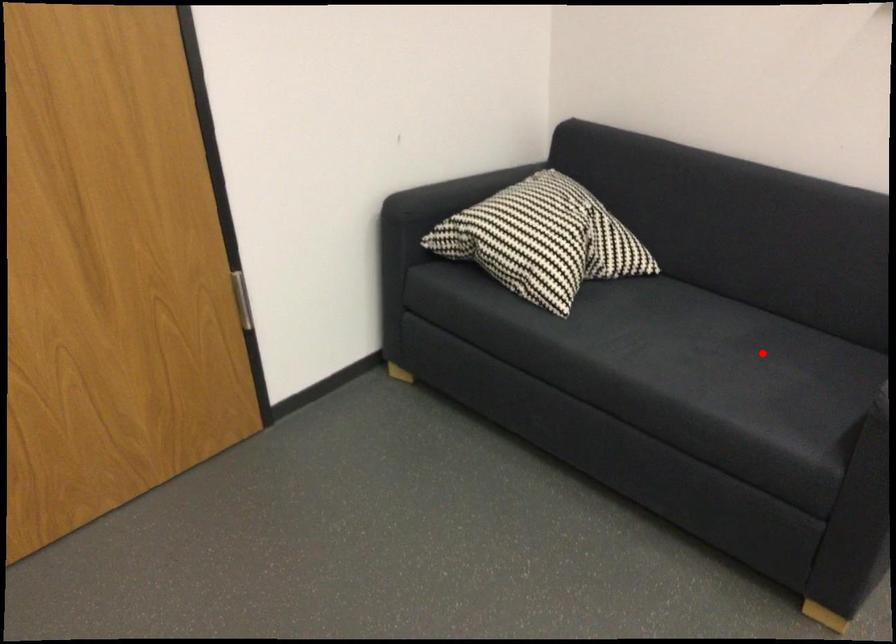
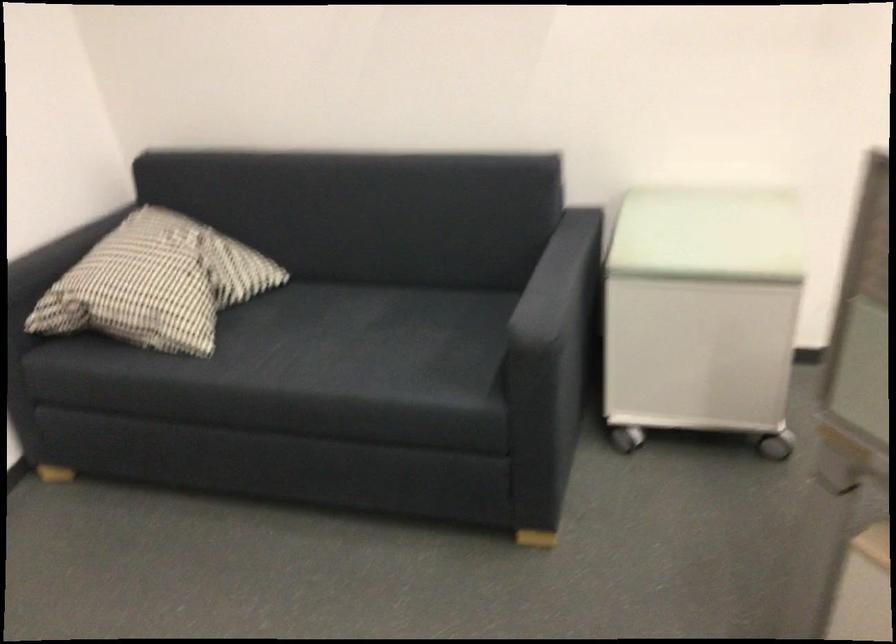
In the second image, find the point that corresponds to the highlighted location in the first image.

(410, 327)